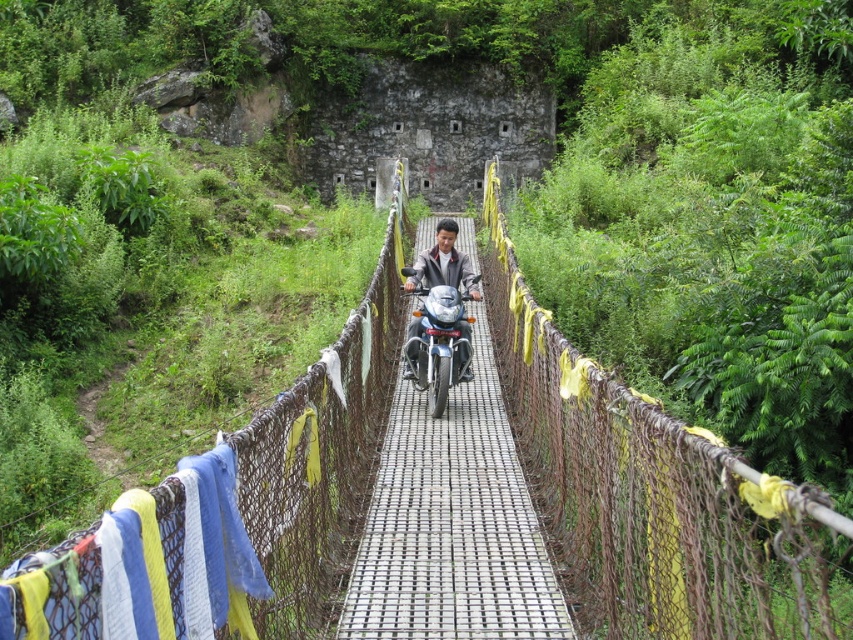
Question: Does blue woven cloth at left appear on the right side of matte black motorcycle at center?

Choices:
 (A) no
 (B) yes

Answer: (A)

Question: Is blue woven cloth at left closer to camera compared to matte black motorcycle at center?

Choices:
 (A) yes
 (B) no

Answer: (A)

Question: Which point is farther to the camera?

Choices:
 (A) (38, 616)
 (B) (440, 280)

Answer: (B)

Question: Which point is closer to the camera?

Choices:
 (A) blue woven cloth at left
 (B) matte black motorcycle at center

Answer: (A)

Question: Does blue woven cloth at left have a smaller size compared to matte black motorcycle at center?

Choices:
 (A) no
 (B) yes

Answer: (B)